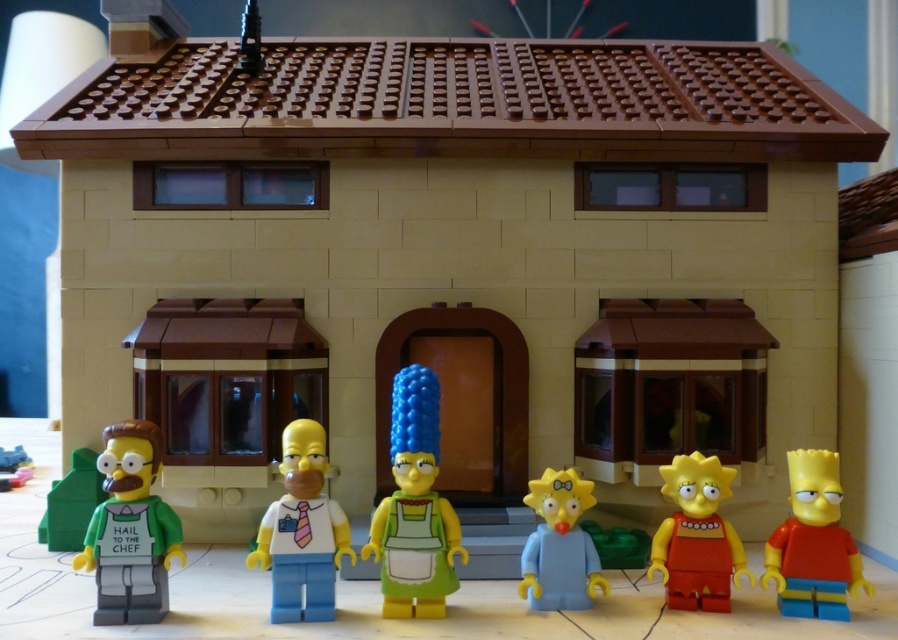
Consider the image. You are standing in front of the LEGO model of the Simpson family house. You notice the green matte shirt at left and the smooth plastic toy at lower left. Which object is positioned higher from the ground?

The green matte shirt at left is above the smooth plastic toy at lower left, so the green matte shirt at left is higher from the ground.

You are standing in front of the LEGO model of the Simpson family house. You need to locate the white matte shirt and tie at center. Where exactly is it positioned?

The white matte shirt and tie at center is positioned at point (302, 531).